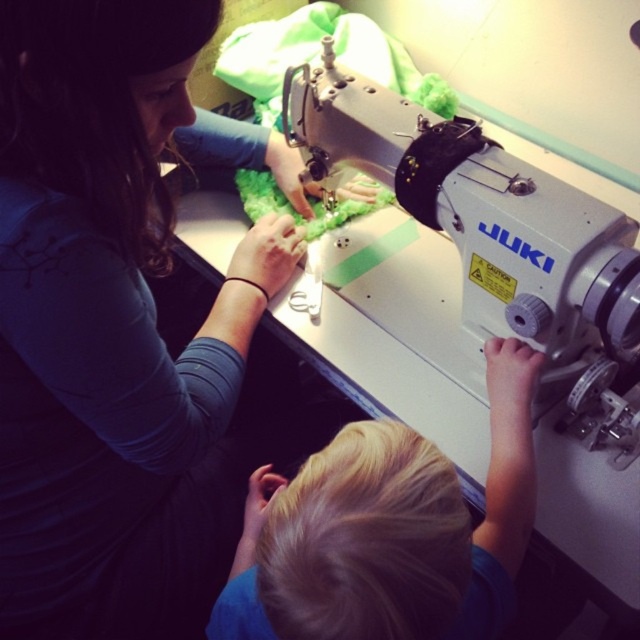
You are a photographer trying to capture a clear shot of the blonde hair at lower center without the matte blue shirt at upper left blocking it. What adjustment should you make to your camera position?

The matte blue shirt at upper left is in front of the blonde hair at lower center, so you should move your camera position backward to create more distance between the two objects, allowing the blonde hair at lower center to be visible without obstruction.

You are a safety inspector checking the setup of a sewing workshop. You notice the silver metallic sewing machine at center and the blonde hair at lower center. According to safety guidelines, the sewing machine must be positioned so that it is not blocking the view of any nearby children. Does the current arrangement comply with this requirement?

The silver metallic sewing machine at center is further to the viewer than blonde hair at lower center, meaning the machine is closer to the inspector and blocking the view of the child. This does not comply with safety guidelines as the machine obstructs visibility of the blonde hair at lower center.

You are standing in front of the Juki industrial sewing machine and notice two points marked in the scene. Which of these points, point (602, 500) or point (250, 538), is closer to you?

Point (602, 500) is closer to the viewer than point (250, 538).